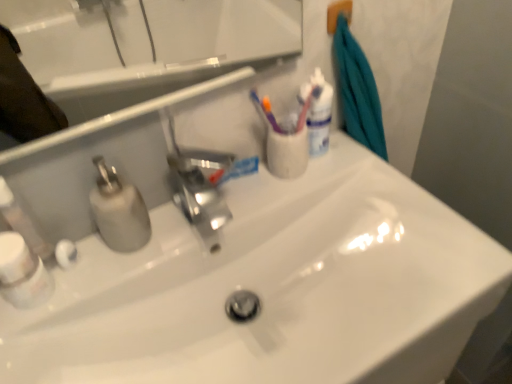
What are the coordinates of `vacant area located to the right-hand side of white glossy toothpaste at center` in the screenshot? It's located at (308, 177).